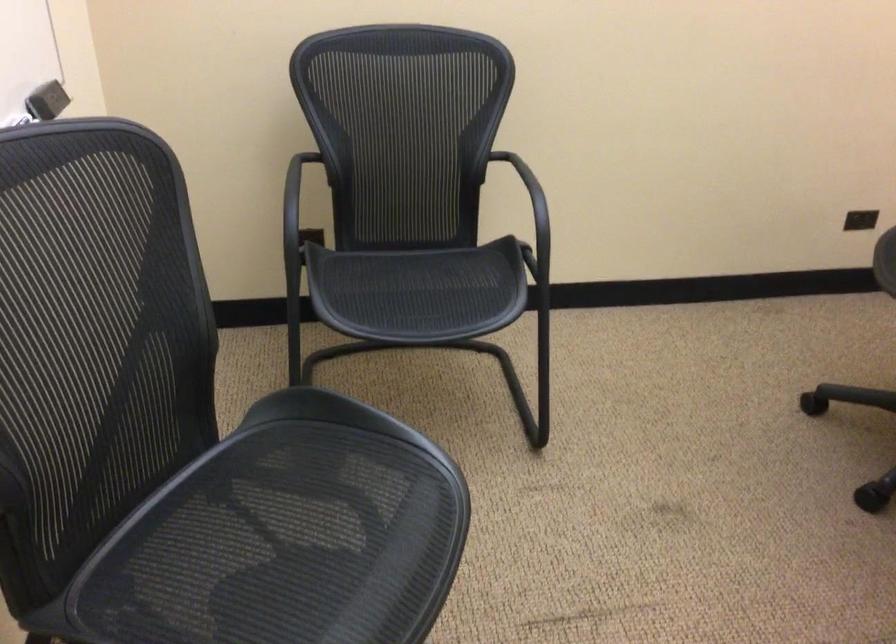
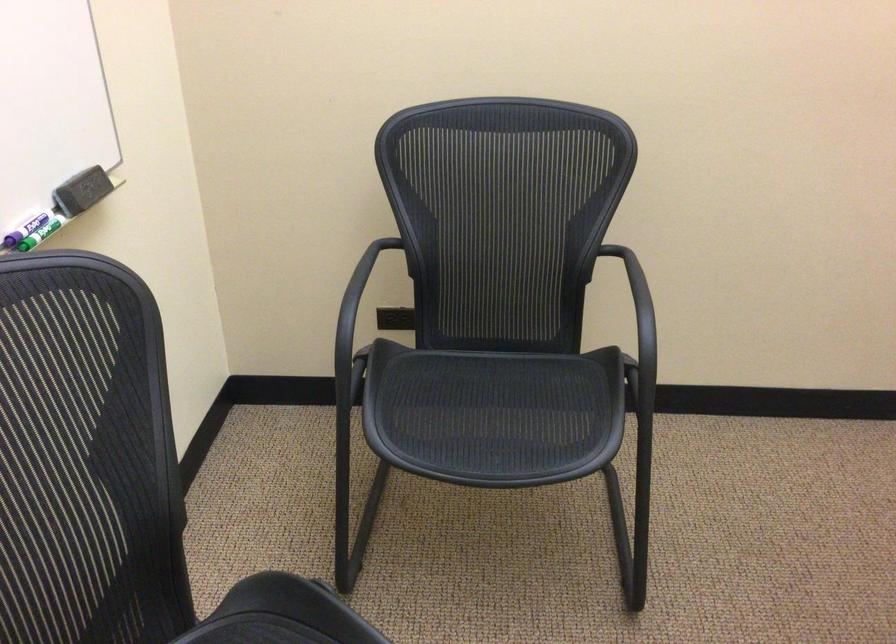
In the second image, find the point that corresponds to [410,292] in the first image.

(478, 413)